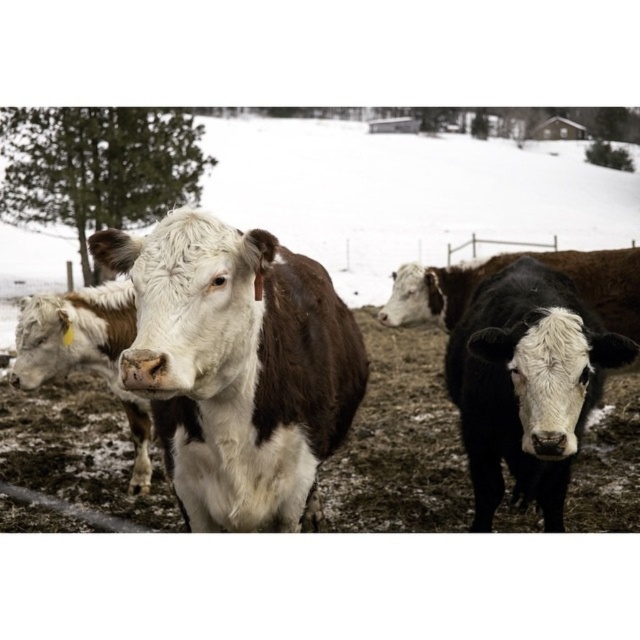
Question: Can you confirm if brown/white fur at center is thinner than white matte cow at center?

Choices:
 (A) yes
 (B) no

Answer: (A)

Question: Which object appears farthest from the camera in this image?

Choices:
 (A) white fur cow at center
 (B) brown/white fur at center

Answer: (A)

Question: Is white fur cow at center bigger than white matte cow at center?

Choices:
 (A) yes
 (B) no

Answer: (B)

Question: Which point is farther from the camera taking this photo?

Choices:
 (A) (38, 381)
 (B) (252, 323)

Answer: (A)

Question: Is brown/white fur at center further to camera compared to white matte cow at center?

Choices:
 (A) no
 (B) yes

Answer: (A)

Question: Which of the following is the closest to the observer?

Choices:
 (A) (416, 422)
 (B) (109, 332)

Answer: (B)